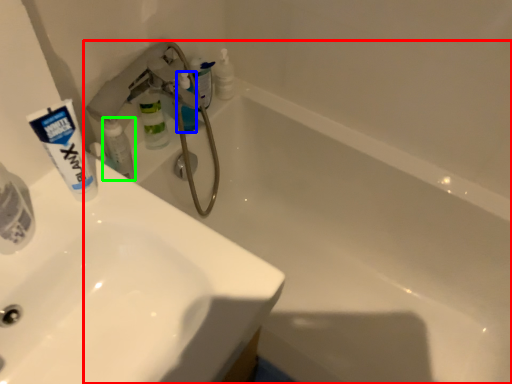
Question: Considering the real-world distances, which object is closest to bathtub (highlighted by a red box)? toiletry (highlighted by a blue box) or toiletry (highlighted by a green box).

Choices:
 (A) toiletry
 (B) toiletry

Answer: (A)